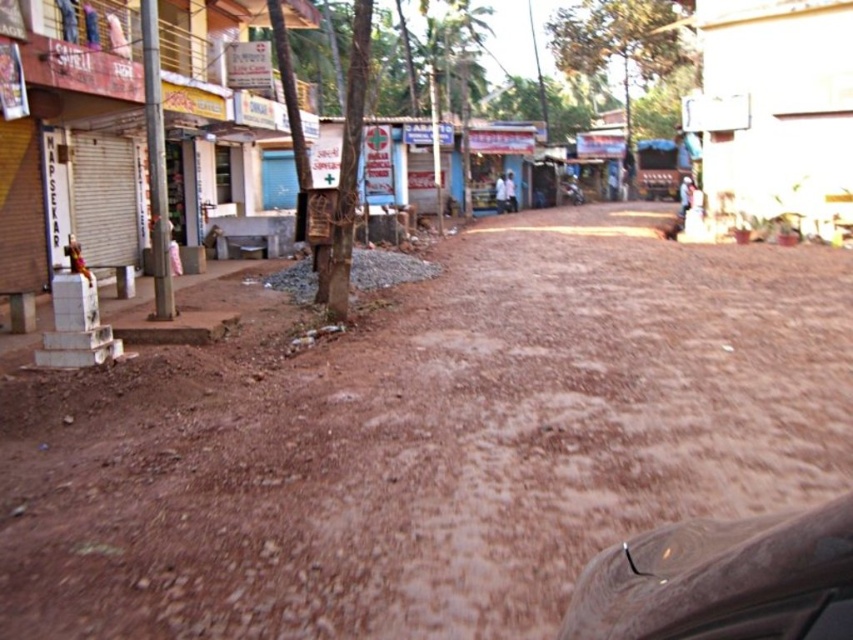
Can you confirm if brown dusty ground at center is smaller than shiny metallic car at lower right?

Actually, brown dusty ground at center might be larger than shiny metallic car at lower right.

In the scene shown: How much distance is there between brown dusty ground at center and shiny metallic car at lower right?

brown dusty ground at center and shiny metallic car at lower right are 3.55 meters apart.

Who is more forward, (543, 532) or (712, 611)?

Point (712, 611) is in front.

Image resolution: width=853 pixels, height=640 pixels. What are the coordinates of `brown dusty ground at center` in the screenshot? It's located at (428, 442).